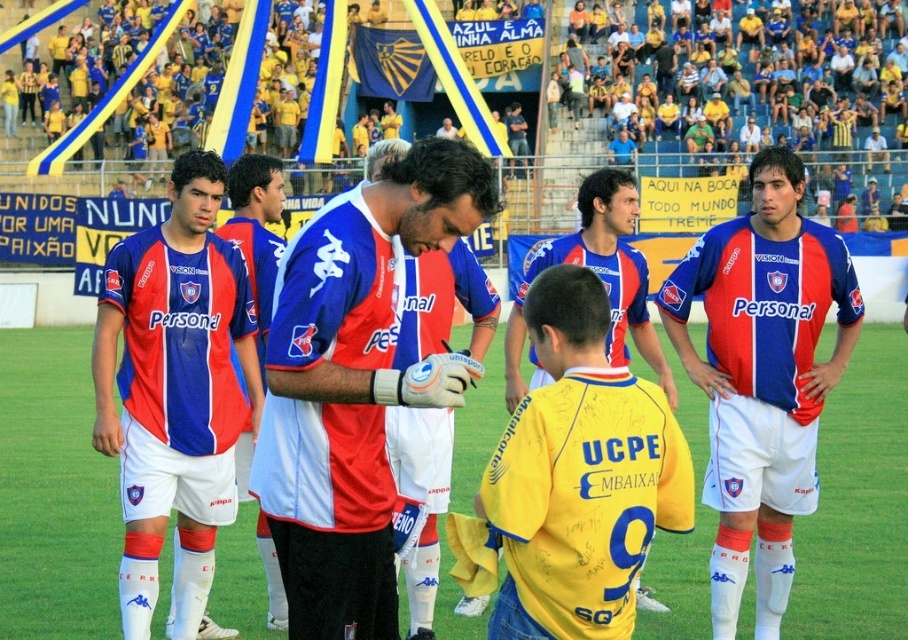
Question: Can you confirm if matte blue and white jersey at center is positioned to the right of matte blue jersey at right?

Choices:
 (A) no
 (B) yes

Answer: (A)

Question: Among these objects, which one is farthest from the camera?

Choices:
 (A) matte jersey at center
 (B) matte blue and red jersey at center
 (C) blue and red jersey at center

Answer: (A)

Question: Is matte blue and white jersey at center above matte blue jersey at right?

Choices:
 (A) yes
 (B) no

Answer: (A)

Question: Can you confirm if yellow jersey at center is thinner than blue and red jersey at center?

Choices:
 (A) yes
 (B) no

Answer: (A)

Question: Which of these objects is positioned closest to the matte blue jersey at right?

Choices:
 (A) blue and red jersey at center
 (B) matte blue and red jersey at center
 (C) yellow jersey at center
 (D) matte jersey at center

Answer: (A)

Question: Which of the following is the closest to the observer?

Choices:
 (A) matte blue and white jersey at center
 (B) matte jersey at center
 (C) yellow jersey at center

Answer: (C)